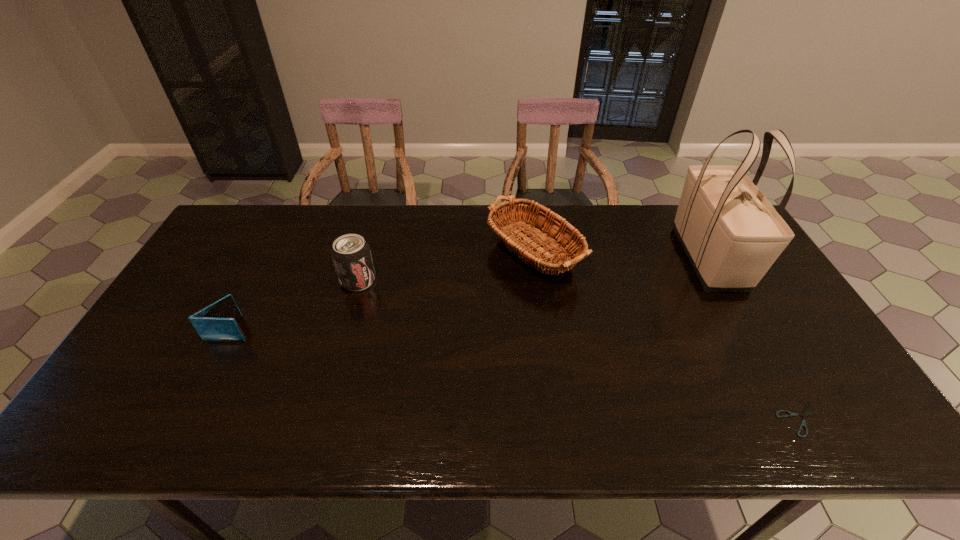
Find the location of a particular element. Image resolution: width=960 pixels, height=540 pixels. vacant space at the far edge of the desktop is located at coordinates (449, 207).

In the image, there is a desktop. At what (x,y) coordinates should I click in order to perform the action: click on free space at the near edge. Please return your answer as a coordinate pair (x, y). This screenshot has width=960, height=540. Looking at the image, I should click on (548, 442).

Where is `vacant region at the left edge of the desktop`? Image resolution: width=960 pixels, height=540 pixels. vacant region at the left edge of the desktop is located at coordinates (143, 346).

Find the location of a particular element. free space at the right edge is located at coordinates (771, 308).

Identify the location of vacant region between the shopping bag and the basket. The height and width of the screenshot is (540, 960). point(619,252).

Find the location of a particular element. The image size is (960, 540). empty space that is in between the shears and the fourth object from right to left is located at coordinates (580, 349).

Find the location of a particular element. The image size is (960, 540). free space between the shopping bag and the shortest object is located at coordinates (756, 339).

Locate an element on the screen. free area in between the fourth object from right to left and the shears is located at coordinates (580, 349).

Where is `empty space between the third object from right to left and the nearest object`? This screenshot has height=540, width=960. empty space between the third object from right to left and the nearest object is located at coordinates (x=666, y=333).

This screenshot has width=960, height=540. I want to click on free space between the shortest object and the basket, so click(x=666, y=333).